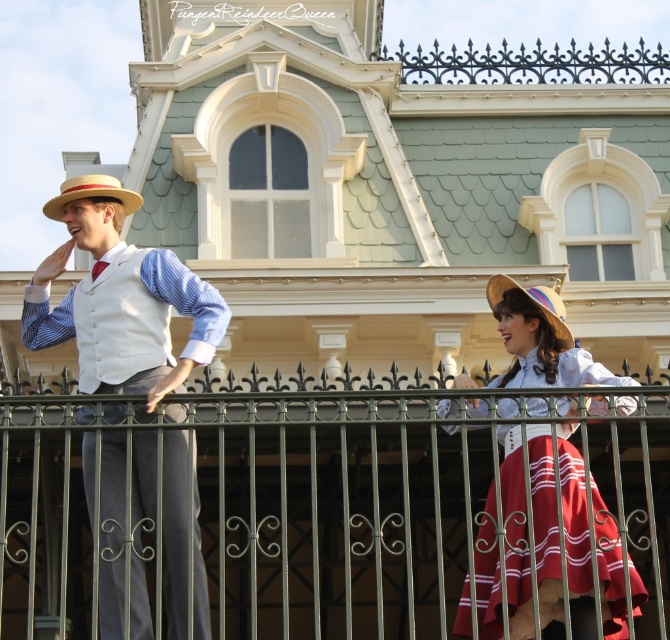
Question: Which of the following is the farthest from the observer?

Choices:
 (A) green wrought iron fence at center
 (B) matte white vest at left

Answer: (B)

Question: Among these points, which one is nearest to the camera?

Choices:
 (A) (570, 342)
 (B) (70, 200)
 (C) (271, 449)
 (D) (115, 298)

Answer: (D)

Question: Which object is closer to the camera taking this photo?

Choices:
 (A) matte red skirt at center
 (B) natural straw hat at center

Answer: (A)

Question: Is matte red skirt at center positioned at the back of straw textured cowboy hat at left?

Choices:
 (A) no
 (B) yes

Answer: (A)

Question: Does matte red skirt at center have a greater width compared to straw textured cowboy hat at left?

Choices:
 (A) no
 (B) yes

Answer: (A)

Question: Observing the image, what is the correct spatial positioning of matte white vest at left in reference to matte red skirt at center?

Choices:
 (A) above
 (B) below

Answer: (B)